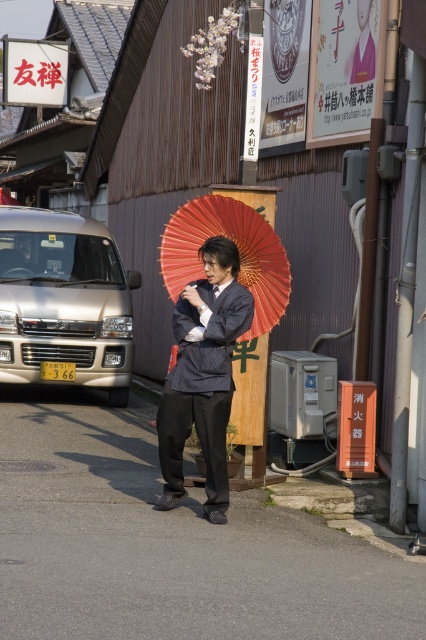
Question: Which object is closer to the camera taking this photo?

Choices:
 (A) red paper umbrella at center
 (B) striped fabric suit at center
 (C) metallic gold van at left

Answer: (B)

Question: Is metallic gold van at left to the right of striped fabric suit at center from the viewer's perspective?

Choices:
 (A) no
 (B) yes

Answer: (A)

Question: Which of the following is the farthest from the observer?

Choices:
 (A) striped fabric suit at center
 (B) red paper umbrella at center

Answer: (B)

Question: Among these points, which one is farthest from the camera?

Choices:
 (A) (63, 243)
 (B) (219, 218)

Answer: (A)

Question: Can you confirm if metallic gold van at left is thinner than red paper umbrella at center?

Choices:
 (A) yes
 (B) no

Answer: (B)

Question: Can you confirm if metallic gold van at left is positioned to the left of red paper umbrella at center?

Choices:
 (A) no
 (B) yes

Answer: (B)